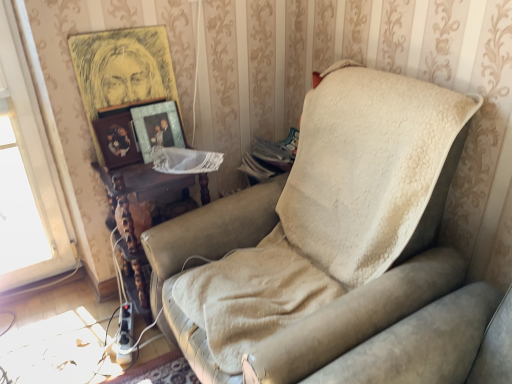
Question: Is wooden picture frame at upper left, the first picture frame positioned from the top, positioned far away from woodenobject at left, acting as the first picture frame starting from the bottom?

Choices:
 (A) yes
 (B) no

Answer: (B)

Question: Is wooden picture frame at upper left, arranged as the third picture frame when ordered from the bottom, to the right of woodenobject at left, the 3th picture frame viewed from the top, from the viewer's perspective?

Choices:
 (A) yes
 (B) no

Answer: (A)

Question: Can you confirm if wooden picture frame at upper left, arranged as the third picture frame when ordered from the bottom, is positioned to the left of woodenobject at left, acting as the first picture frame starting from the bottom?

Choices:
 (A) yes
 (B) no

Answer: (B)

Question: Is wooden picture frame at upper left, arranged as the third picture frame when ordered from the bottom, directly adjacent to woodenobject at left, the 3th picture frame viewed from the top?

Choices:
 (A) no
 (B) yes

Answer: (A)

Question: From the image's perspective, is wooden picture frame at upper left, arranged as the third picture frame when ordered from the bottom, below woodenobject at left, acting as the first picture frame starting from the bottom?

Choices:
 (A) yes
 (B) no

Answer: (B)

Question: Is wooden picture frame at upper left, arranged as the third picture frame when ordered from the bottom, to the left or to the right of woodenmaterial/texturetable at center in the image?

Choices:
 (A) right
 (B) left

Answer: (B)

Question: From a real-world perspective, relative to woodenmaterial/texturetable at center, is wooden picture frame at upper left, the first picture frame positioned from the top, vertically above or below?

Choices:
 (A) below
 (B) above

Answer: (B)

Question: Is wooden picture frame at upper left, arranged as the third picture frame when ordered from the bottom, inside the boundaries of woodenmaterial/texturetable at center, or outside?

Choices:
 (A) outside
 (B) inside

Answer: (A)

Question: Considering the positions of wooden picture frame at upper left, the first picture frame positioned from the top, and woodenmaterial/texturetable at center in the image, is wooden picture frame at upper left, the first picture frame positioned from the top, wider or thinner than woodenmaterial/texturetable at center?

Choices:
 (A) wide
 (B) thin

Answer: (B)

Question: Is leather studio couch at center spatially inside woodenobject at left, acting as the first picture frame starting from the bottom, or outside of it?

Choices:
 (A) outside
 (B) inside

Answer: (A)

Question: Is leather studio couch at center taller or shorter than woodenobject at left, acting as the first picture frame starting from the bottom?

Choices:
 (A) short
 (B) tall

Answer: (B)

Question: Visually, is leather studio couch at center positioned to the left or to the right of woodenobject at left, the 3th picture frame viewed from the top?

Choices:
 (A) left
 (B) right

Answer: (B)

Question: In the image, is leather studio couch at center positioned in front of or behind woodenobject at left, acting as the first picture frame starting from the bottom?

Choices:
 (A) behind
 (B) front

Answer: (B)

Question: Looking at their shapes, would you say leather studio couch at center is wider or thinner than metallic gold picture frame at upper center, the second picture frame when ordered from top to bottom?

Choices:
 (A) thin
 (B) wide

Answer: (B)

Question: Looking at the image, does leather studio couch at center seem bigger or smaller compared to metallic gold picture frame at upper center, the second picture frame when ordered from top to bottom?

Choices:
 (A) small
 (B) big

Answer: (B)